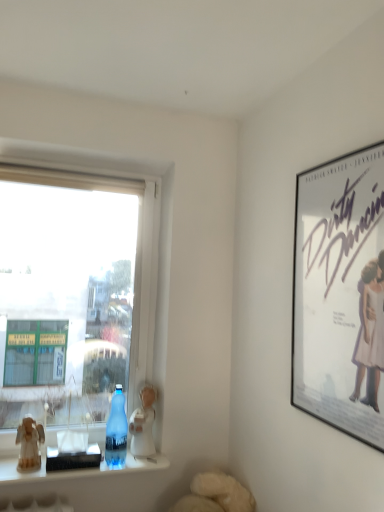
Question: Could transparent glass bottle at window be considered to be inside white porcelain figurine at lower center, which ranks as the 1th figurine in right-to-left order?

Choices:
 (A) no
 (B) yes

Answer: (A)

Question: From a real-world perspective, is white porcelain figurine at lower center, the 2th figurine when ordered from left to right, beneath transparent glass bottle at window?

Choices:
 (A) no
 (B) yes

Answer: (B)

Question: Can you confirm if white porcelain figurine at lower center, which ranks as the 1th figurine in right-to-left order, is shorter than transparent glass bottle at window?

Choices:
 (A) no
 (B) yes

Answer: (A)

Question: From a real-world perspective, is white porcelain figurine at lower center, placed as the 1th figurine when sorted from back to front, located higher than transparent glass bottle at window?

Choices:
 (A) no
 (B) yes

Answer: (A)

Question: Can we say white porcelain figurine at lower center, placed as the 1th figurine when sorted from back to front, lies outside transparent glass bottle at window?

Choices:
 (A) yes
 (B) no

Answer: (A)

Question: Is white porcelain figurine at lower center, which ranks as the 1th figurine in right-to-left order, further to camera compared to transparent glass bottle at window?

Choices:
 (A) no
 (B) yes

Answer: (B)

Question: Considering the relative sizes of transparent glass bottle at window and white porcelain figurine at lower center, placed as the 1th figurine when sorted from back to front, in the image provided, is transparent glass bottle at window thinner than white porcelain figurine at lower center, placed as the 1th figurine when sorted from back to front,?

Choices:
 (A) no
 (B) yes

Answer: (B)

Question: Is transparent glass bottle at window oriented away from white porcelain figurine at lower center, placed as the 1th figurine when sorted from back to front?

Choices:
 (A) no
 (B) yes

Answer: (A)

Question: Is transparent glass bottle at window positioned in front of white porcelain figurine at lower center, acting as the second figurine starting from the front?

Choices:
 (A) no
 (B) yes

Answer: (B)

Question: From a real-world perspective, is transparent glass bottle at window under white porcelain figurine at lower center, placed as the 1th figurine when sorted from back to front?

Choices:
 (A) yes
 (B) no

Answer: (B)

Question: Is transparent glass bottle at window wider than white porcelain figurine at lower center, which ranks as the 1th figurine in right-to-left order?

Choices:
 (A) yes
 (B) no

Answer: (B)

Question: Considering the relative sizes of transparent glass bottle at window and white porcelain figurine at lower center, acting as the second figurine starting from the front, in the image provided, is transparent glass bottle at window shorter than white porcelain figurine at lower center, acting as the second figurine starting from the front,?

Choices:
 (A) no
 (B) yes

Answer: (B)

Question: Are transparent glass bottle at window and wooden figurine at left, the 2th figurine when ordered from right to left, making contact?

Choices:
 (A) no
 (B) yes

Answer: (A)